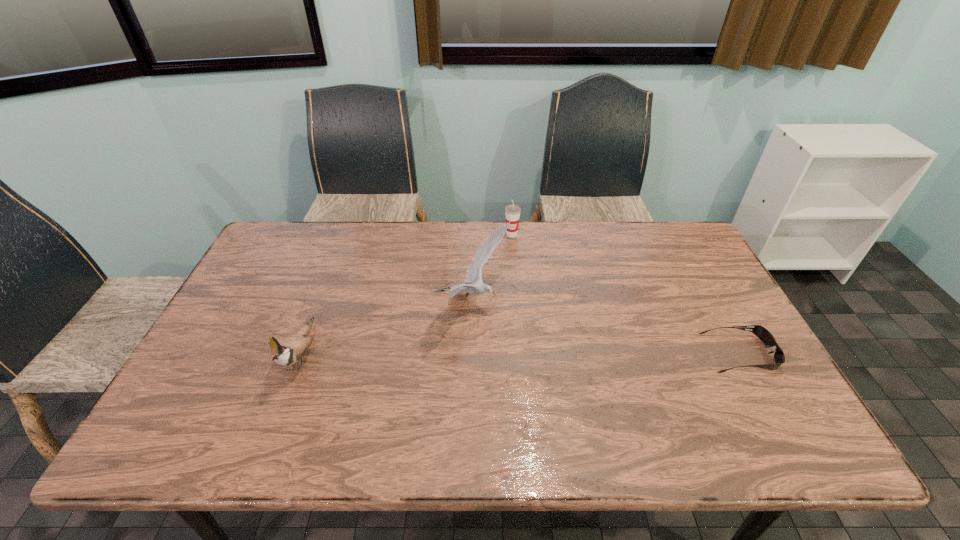
Where is `free space on the desktop that is between the bird and the sunglasses and is positioned on the side of the cup with the logo`? The image size is (960, 540). free space on the desktop that is between the bird and the sunglasses and is positioned on the side of the cup with the logo is located at coordinates (540, 353).

Where is `free space on the desktop that is between the bird and the sunglasses and is positioned at the tip of the beak of the gull`? free space on the desktop that is between the bird and the sunglasses and is positioned at the tip of the beak of the gull is located at coordinates (579, 353).